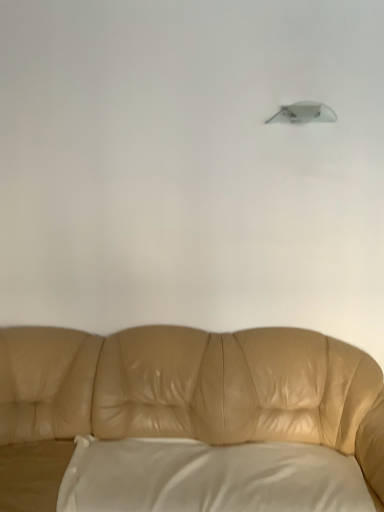
Question: From a real-world perspective, is satin gray lampshade at upper center positioned over white satin pillow at lower center based on gravity?

Choices:
 (A) yes
 (B) no

Answer: (A)

Question: Is satin gray lampshade at upper center oriented away from white satin pillow at lower center?

Choices:
 (A) no
 (B) yes

Answer: (A)

Question: From the image's perspective, is satin gray lampshade at upper center below white satin pillow at lower center?

Choices:
 (A) yes
 (B) no

Answer: (B)

Question: Considering the relative sizes of satin gray lampshade at upper center and white satin pillow at lower center in the image provided, is satin gray lampshade at upper center thinner than white satin pillow at lower center?

Choices:
 (A) no
 (B) yes

Answer: (B)

Question: Is satin gray lampshade at upper center shorter than white satin pillow at lower center?

Choices:
 (A) yes
 (B) no

Answer: (A)

Question: Is satin gray lampshade at upper center not inside white satin pillow at lower center?

Choices:
 (A) no
 (B) yes

Answer: (B)

Question: Is tan leather couch at center facing away from satin gray lampshade at upper center?

Choices:
 (A) no
 (B) yes

Answer: (A)

Question: Can you confirm if tan leather couch at center is wider than satin gray lampshade at upper center?

Choices:
 (A) yes
 (B) no

Answer: (A)

Question: Is tan leather couch at center further to camera compared to satin gray lampshade at upper center?

Choices:
 (A) yes
 (B) no

Answer: (B)

Question: Can you confirm if tan leather couch at center is taller than satin gray lampshade at upper center?

Choices:
 (A) no
 (B) yes

Answer: (B)

Question: Can you confirm if tan leather couch at center is shorter than satin gray lampshade at upper center?

Choices:
 (A) yes
 (B) no

Answer: (B)

Question: Does tan leather couch at center appear on the left side of satin gray lampshade at upper center?

Choices:
 (A) yes
 (B) no

Answer: (A)

Question: Is white satin pillow at lower center facing towards satin gray lampshade at upper center?

Choices:
 (A) no
 (B) yes

Answer: (A)